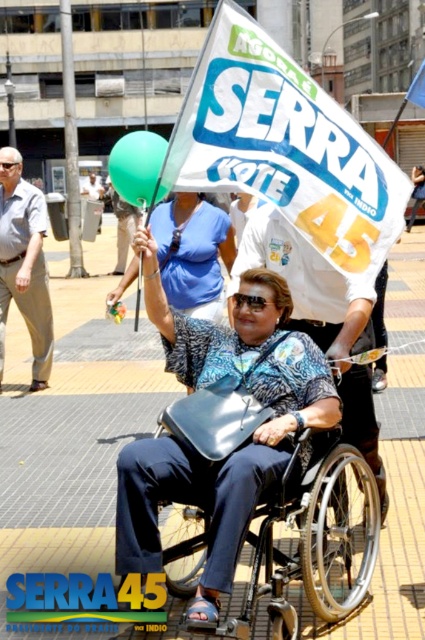
You are attending a political rally and notice two items in the scene. One is the matte blue shirt at center and the other is the green rubber balloon at upper center. Which item is positioned closer to you?

The matte blue shirt at center is closer to the viewer than the green rubber balloon at upper center.

You are at the event and want to see both the white paper sign at upper center and the matte blue shirt at center. Which one is located to the right of the other?

The white paper sign at upper center is located to the right of the matte blue shirt at center.